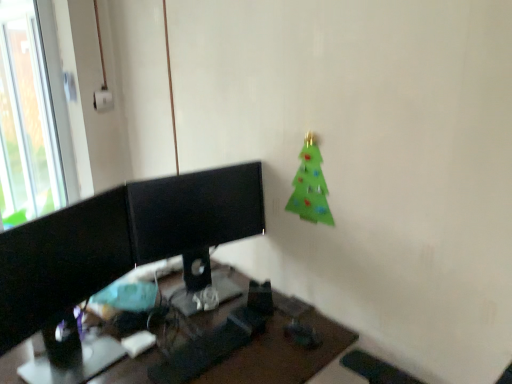
At what (x,y) coordinates should I click in order to perform the action: click on vacant space underneath black glossy monitor at left (from a real-world perspective). Please return your answer as a coordinate pair (x, y). The image size is (512, 384). Looking at the image, I should click on (79, 363).